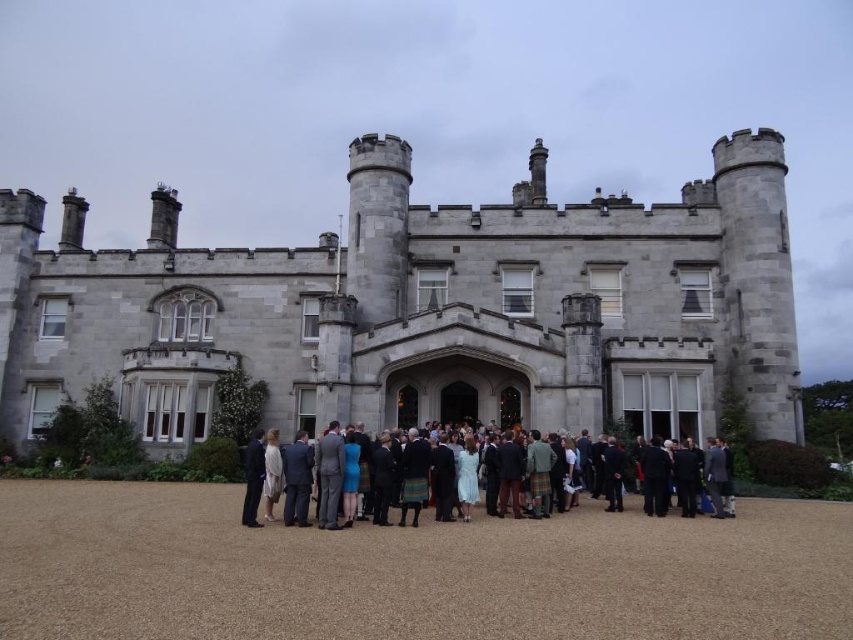
You are standing in a park and see the gray stone castle at center. If you want to take a photo of it from where you are standing, will it fit in the frame of your smartphone camera which has a maximum field of view of 60 degrees?

The gray stone castle at center is 188.10 feet from viewer. To determine if it fits in the 60 degree field of view, we need to know the castle height. Since the height isnecessary information is missing, we cannot confirm if it fits.

You are a photographer planning to capture a group photo of the matte black suit at center and the gray stone castle at center. Given that the castle is wider than the suit, how should you position them to ensure both are fully visible in the frame?

Since the gray stone castle at center is wider than the matte black suit at center, position the castle centrally and place the suit slightly off to one side to accommodate the castle width while keeping both in frame.

You are standing in front of a historic building and notice a specific point marked at coordinates (422, 308). Based on the scene description, what does this point most likely represent?

The point at coordinates (422, 308) most likely represents the gray stone castle at center as described in the scene.